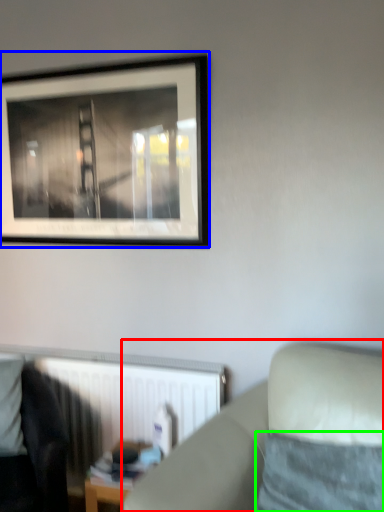
Question: Based on their relative distances, which object is farther from studio couch (highlighted by a red box)? Choose from picture frame (highlighted by a blue box) and pillow (highlighted by a green box).

Choices:
 (A) picture frame
 (B) pillow

Answer: (A)